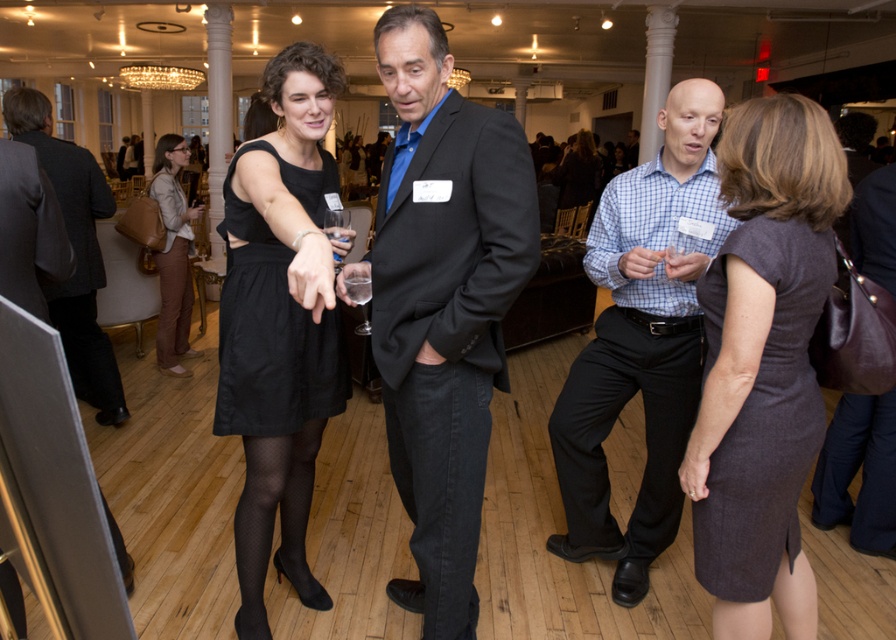
You are standing at the entrance of the room and see two points marked in the image. Which point is closer to you, point (683, 196) or point (179, 209)?

Point (683, 196) is in front of point (179, 209), so it is closer to you.

You are a guest at this event and need to pass from the matte black suit at center to the matte brown pants at lower left. The path is clear, but you have a tray of drinks that is 2.5 meters long. Can you carry it horizontally through the space between them without tilting?

The distance between the matte black suit at center and the matte brown pants at lower left is 3.01 meters. Since your tray is 2.5 meters long, you can carry it horizontally through the space as the distance is sufficient.